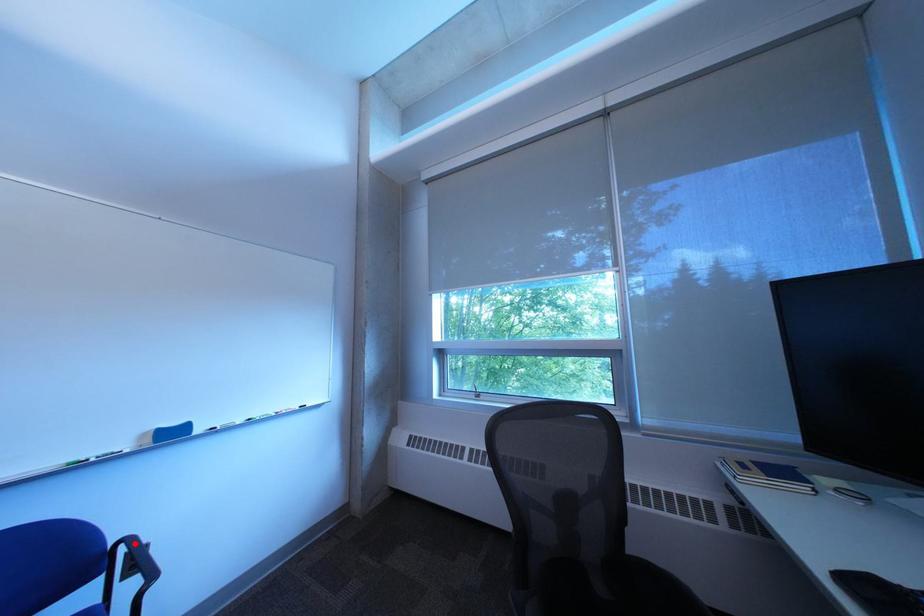
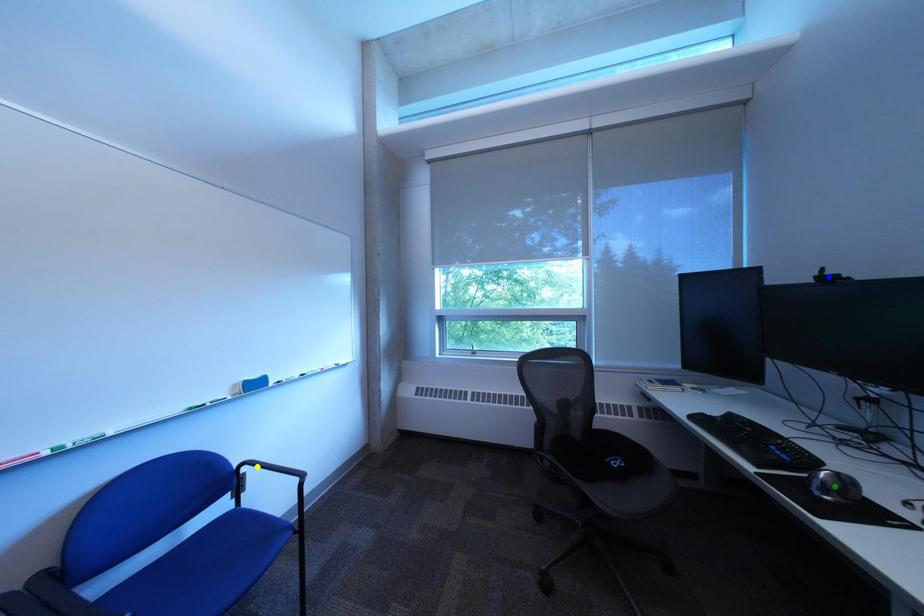
Question: I am providing you with two images of the same scene from different viewpoints. A red point is marked on the first image. You are given multiple points on the second image. Which point in image 2 is actually the same real-world point as the red point in image 1?

Choices:
 (A) yellow point
 (B) green point
 (C) blue point

Answer: (A)